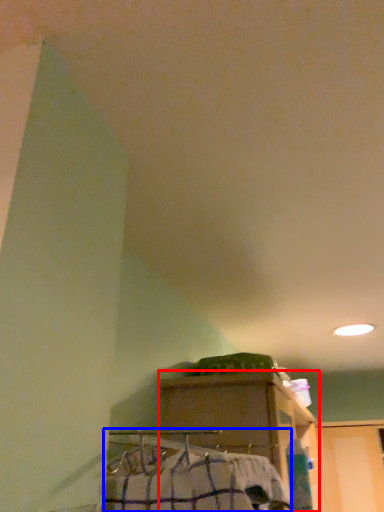
Question: Which object is closer to the camera taking this photo, furniture (highlighted by a red box) or job (highlighted by a blue box)?

Choices:
 (A) furniture
 (B) job

Answer: (B)